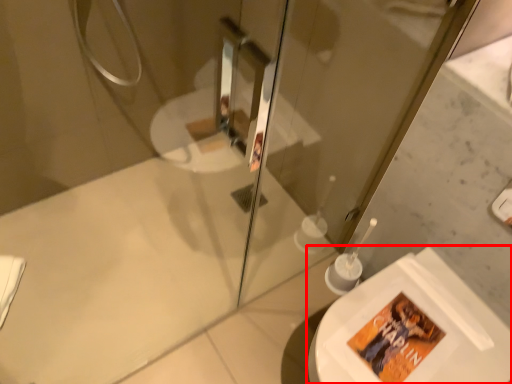
Question: Observing the image, what is the correct spatial positioning of toilet (annotated by the red box) in reference to screen door?

Choices:
 (A) right
 (B) left

Answer: (A)